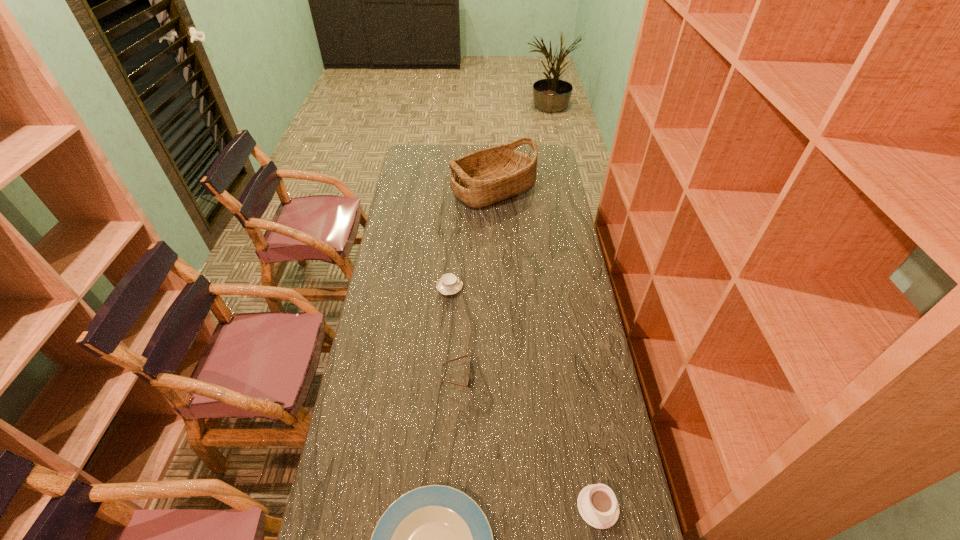
This screenshot has width=960, height=540. I want to click on the farthest object, so click(x=487, y=176).

Locate an element on the screen. Image resolution: width=960 pixels, height=540 pixels. the tallest object is located at coordinates (487, 176).

The image size is (960, 540). I want to click on the nearer teacup, so click(597, 504).

This screenshot has width=960, height=540. Find the location of `the fourth nearest object`. the fourth nearest object is located at coordinates 448,284.

Locate an element on the screen. This screenshot has width=960, height=540. the left teacup is located at coordinates (448, 284).

The width and height of the screenshot is (960, 540). In order to click on the third farthest object in this screenshot , I will do point(469,379).

This screenshot has height=540, width=960. What are the coordinates of `vacant region located on the back of the tallest object` in the screenshot? It's located at (492, 155).

The width and height of the screenshot is (960, 540). In order to click on vacant space located 0.170m on the handle side of the nearer teacup in this screenshot , I will do `click(584, 424)`.

The image size is (960, 540). In order to click on vacant area situated 0.070m on the handle side of the nearer teacup in this screenshot , I will do `click(589, 458)`.

I want to click on free space located 0.160m on the handle side of the nearer teacup, so click(x=585, y=427).